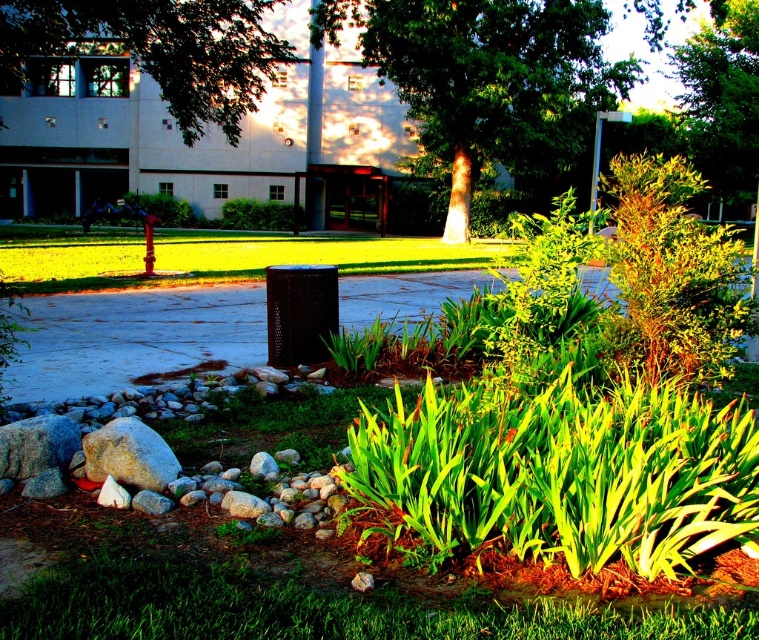
Is green leafy tree at upper left taller than green leafy tree at upper center?

Yes.

Does green leafy tree at upper left have a lesser width compared to green leafy tree at upper center?

In fact, green leafy tree at upper left might be wider than green leafy tree at upper center.

This screenshot has height=640, width=759. Find the location of `green leafy tree at upper left`. green leafy tree at upper left is located at coordinates (156, 49).

Is point (178, 564) less distant than point (694, 157)?

That is True.

Where is `green grass at lower center`? This screenshot has width=759, height=640. green grass at lower center is located at coordinates (307, 609).

Based on the photo, between green leafy tree at center and green leafy tree at upper center, which one is positioned higher?

green leafy tree at upper center is higher up.

Can you confirm if green leafy tree at center is positioned to the right of green leafy tree at upper center?

In fact, green leafy tree at center is to the left of green leafy tree at upper center.

Image resolution: width=759 pixels, height=640 pixels. What do you see at coordinates (493, 80) in the screenshot? I see `green leafy tree at center` at bounding box center [493, 80].

Locate an element on the screen. The image size is (759, 640). green leafy tree at center is located at coordinates (493, 80).